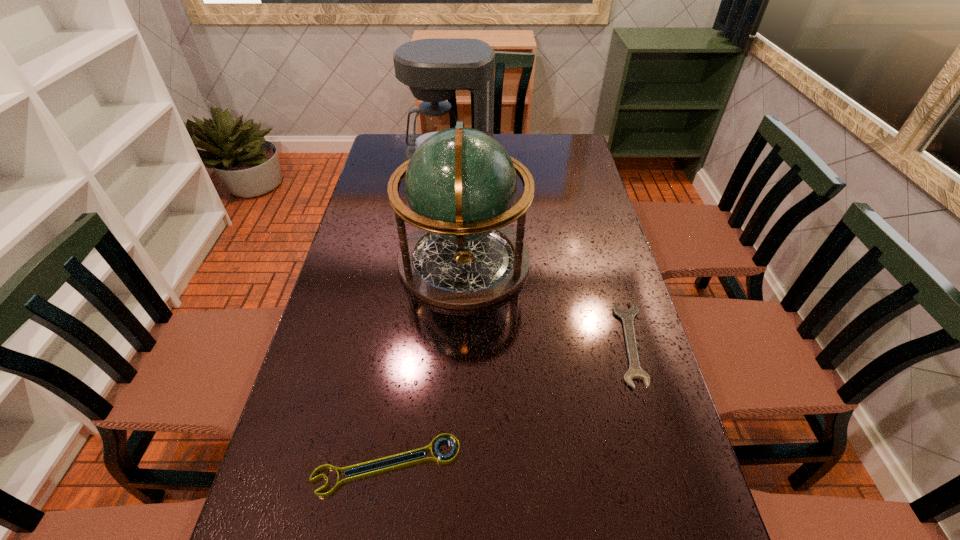
Where is `object situated at the far edge`? The height and width of the screenshot is (540, 960). object situated at the far edge is located at coordinates (434, 69).

In order to click on globe located at the left edge in this screenshot , I will do `click(461, 184)`.

Where is `coffee maker that is at the left edge`? The height and width of the screenshot is (540, 960). coffee maker that is at the left edge is located at coordinates (x=434, y=69).

The image size is (960, 540). I want to click on wrench located at the left edge, so click(x=444, y=437).

Where is `object that is at the right edge`? object that is at the right edge is located at coordinates (627, 316).

Where is `object present at the far left corner`? object present at the far left corner is located at coordinates (434, 69).

I want to click on vacant space at the left edge, so click(x=396, y=239).

Identify the location of vacant space at the right edge of the desktop. (588, 242).

In the image, there is a desktop. Where is `vacant space at the far right corner`? The width and height of the screenshot is (960, 540). vacant space at the far right corner is located at coordinates (542, 148).

Where is `vacant area between the farther wrench and the left wrench`? This screenshot has width=960, height=540. vacant area between the farther wrench and the left wrench is located at coordinates (509, 404).